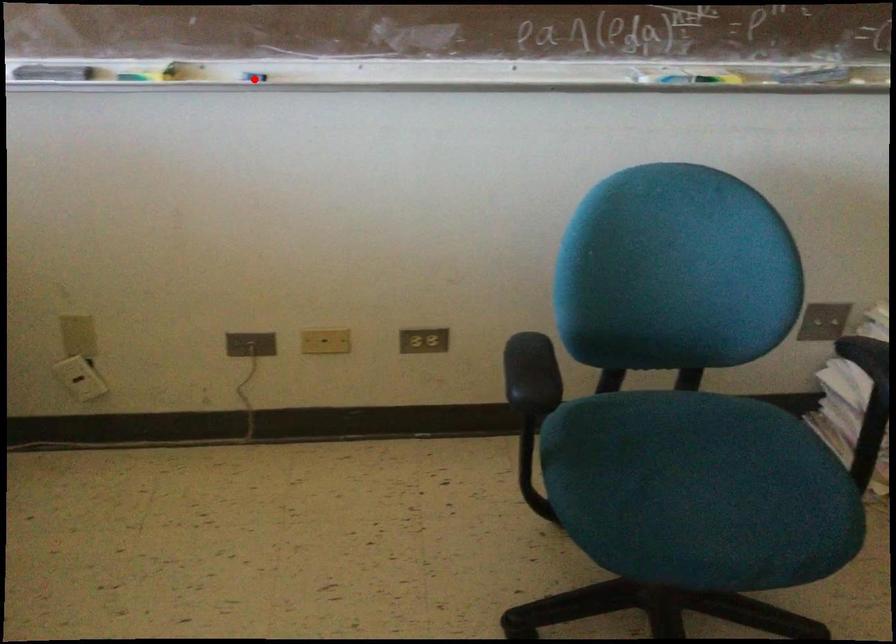
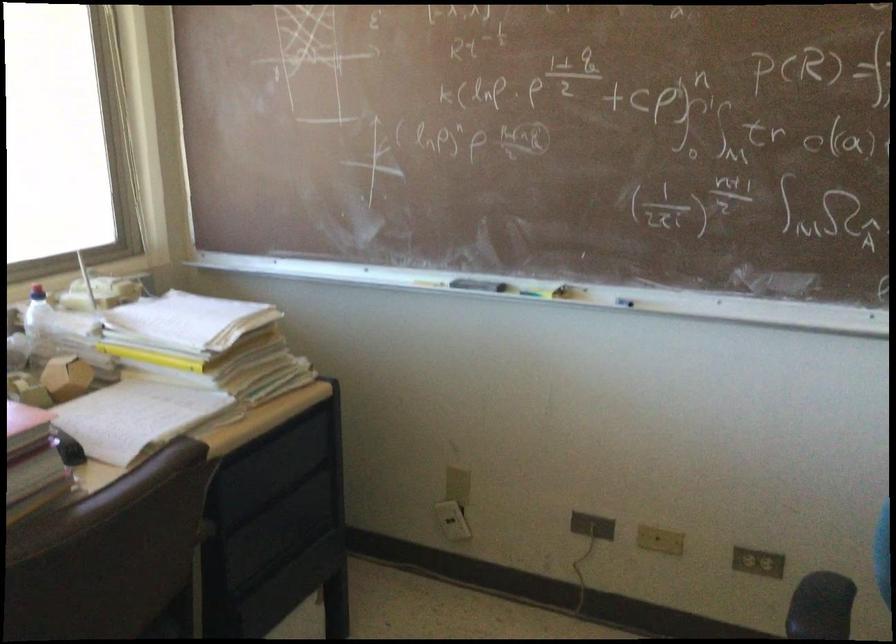
Question: I am providing you with two images of the same scene from different viewpoints. Image1 has a red point marked. In image2, the corresponding 3D location appears at what relative position? Reply with the corresponding letter.

Choices:
 (A) Closer
 (B) Farther

Answer: (B)